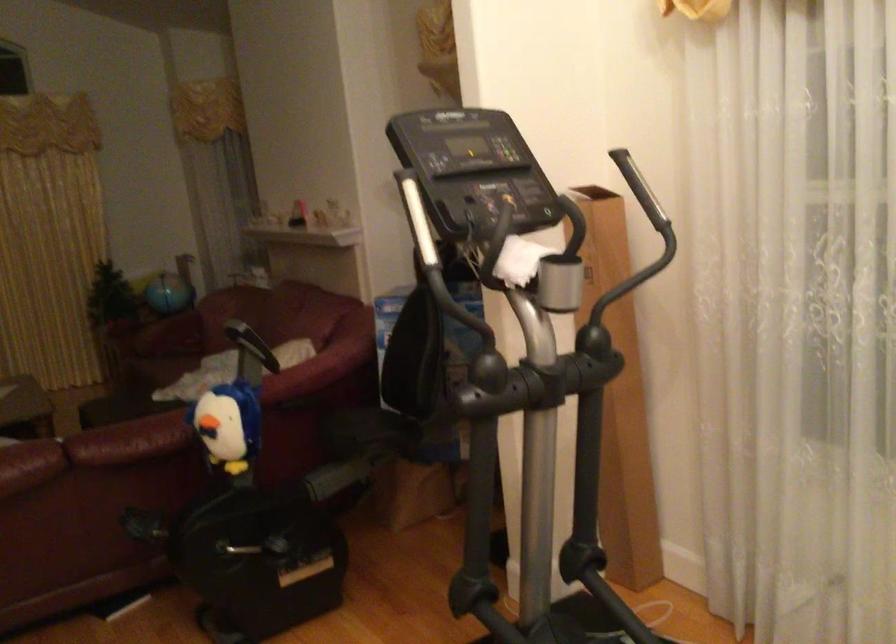
Question: Based on the continuous images, in which direction is the camera rotating? Reply with the corresponding letter.

Choices:
 (A) Left
 (B) Right
 (C) Up
 (D) Down

Answer: (A)